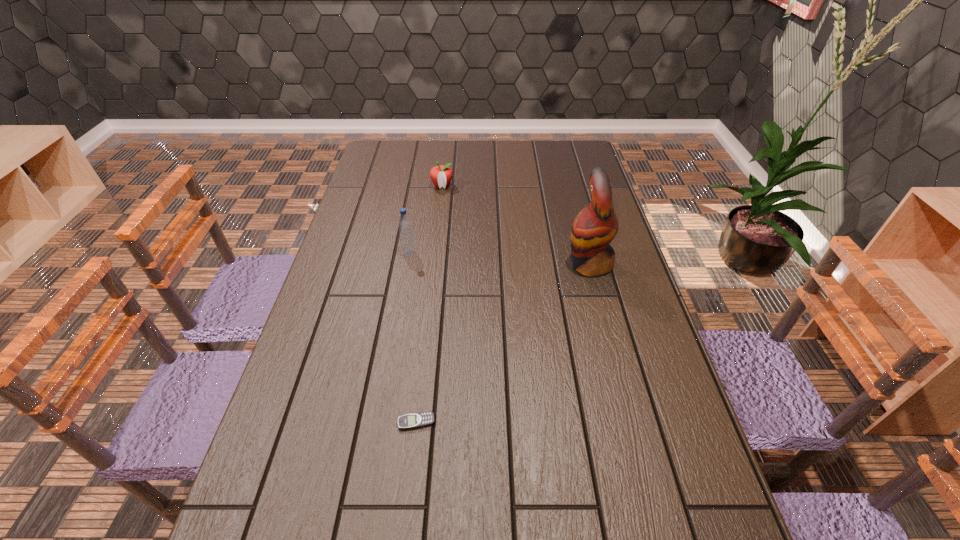
Locate an element on the screen. The image size is (960, 540). vacant space that is in between the parrot and the leftmost object is located at coordinates (499, 258).

This screenshot has width=960, height=540. Find the location of `blank region between the third shortest object and the farthest object`. blank region between the third shortest object and the farthest object is located at coordinates (425, 219).

The image size is (960, 540). In order to click on vacant space in between the tallest object and the third shortest object in this screenshot , I will do `click(499, 258)`.

At what (x,y) coordinates should I click in order to perform the action: click on unoccupied area between the parrot and the nearest object. Please return your answer as a coordinate pair (x, y). This screenshot has height=540, width=960. Looking at the image, I should click on (503, 343).

The height and width of the screenshot is (540, 960). In order to click on free space between the parrot and the water bottle in this screenshot , I will do `click(499, 258)`.

I want to click on free space between the second tallest object and the rightmost object, so point(499,258).

The width and height of the screenshot is (960, 540). In order to click on free space between the beeper and the second tallest object in this screenshot , I will do `click(413, 338)`.

This screenshot has height=540, width=960. I want to click on free space between the apple and the leftmost object, so click(425, 219).

Where is `free space between the third tallest object and the parrot`? Image resolution: width=960 pixels, height=540 pixels. free space between the third tallest object and the parrot is located at coordinates (516, 225).

Identify the location of the second closest object to the parrot. (441, 175).